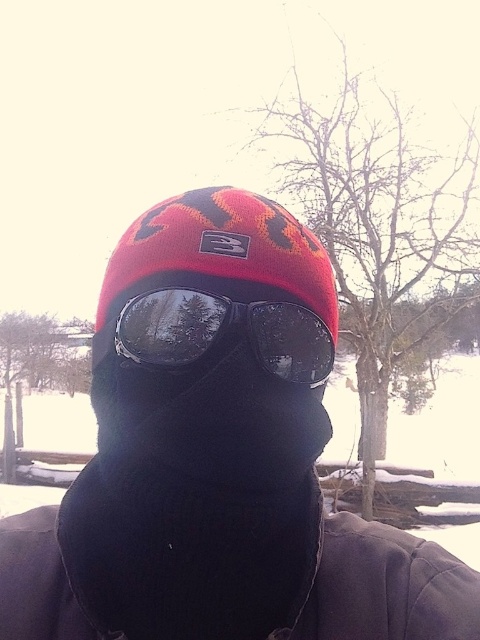
Question: Which point is closer to the camera?

Choices:
 (A) glossy plastic goggles at center
 (B) matte black ski mask at center

Answer: (B)

Question: Is matte black ski mask at center below glossy plastic goggles at center?

Choices:
 (A) yes
 (B) no

Answer: (A)

Question: Can you confirm if matte black ski mask at center is wider than glossy plastic goggles at center?

Choices:
 (A) yes
 (B) no

Answer: (A)

Question: Which point is farther from the camera taking this photo?

Choices:
 (A) [x=298, y=374]
 (B) [x=336, y=305]

Answer: (B)

Question: Can you confirm if matte black ski mask at center is wider than glossy plastic goggles at center?

Choices:
 (A) yes
 (B) no

Answer: (A)